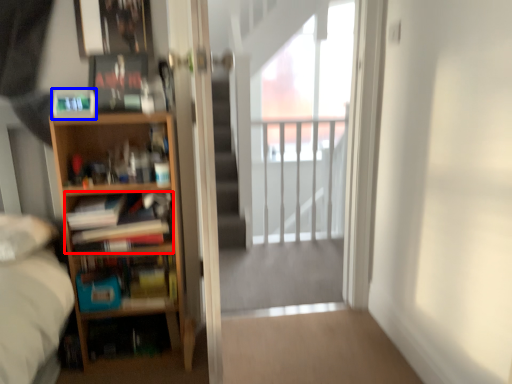
Question: Which point is further to the camera, book (highlighted by a red box) or paperback book (highlighted by a blue box)?

Choices:
 (A) book
 (B) paperback book

Answer: (A)